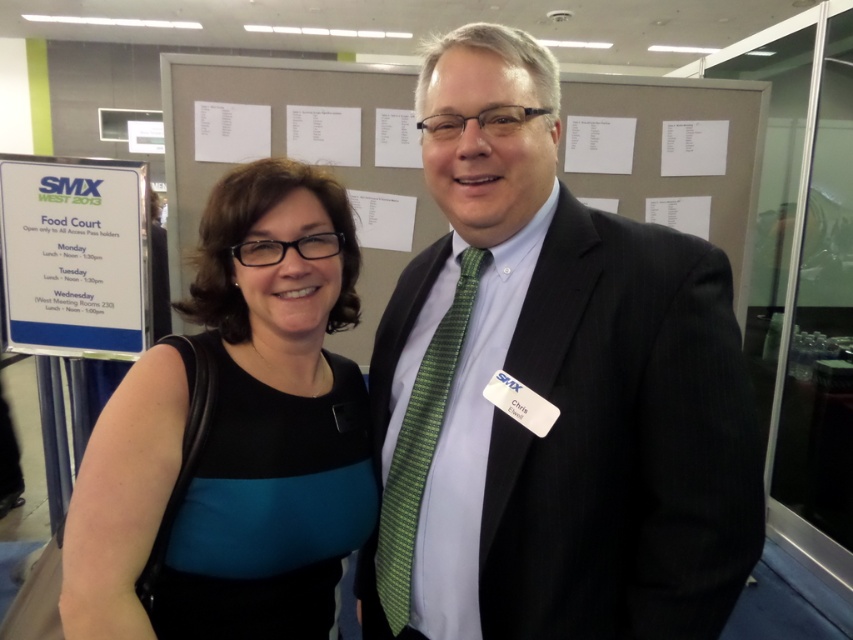
Question: Can you confirm if white paper at center is bigger than green textured tie at center?

Choices:
 (A) yes
 (B) no

Answer: (A)

Question: Is dark gray suit at center closer to the viewer compared to white paper at center?

Choices:
 (A) yes
 (B) no

Answer: (A)

Question: Can you confirm if dark gray suit at center is positioned below green textured tie at center?

Choices:
 (A) no
 (B) yes

Answer: (A)

Question: Among these objects, which one is farthest from the camera?

Choices:
 (A) black fabric dress at left
 (B) white paper at center

Answer: (B)

Question: Among these objects, which one is nearest to the camera?

Choices:
 (A) black fabric dress at left
 (B) dark gray suit at center
 (C) green textured tie at center

Answer: (B)

Question: Which point is farther from the camera taking this photo?

Choices:
 (A) (456, 509)
 (B) (96, 481)
 (C) (372, 109)
 (D) (379, 515)

Answer: (C)